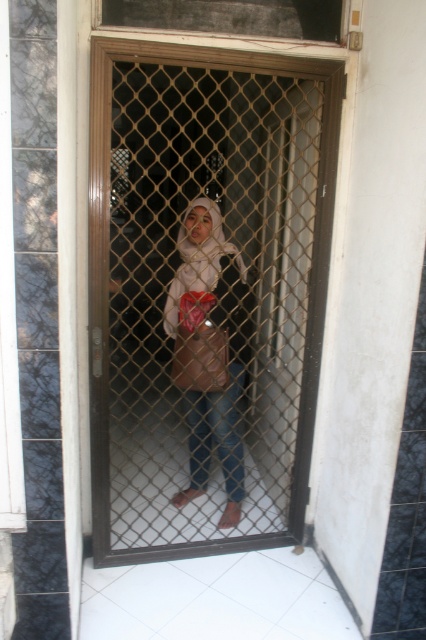
Based on the scene described, which object is positioned to the right when observing the metal mesh door at center and the matte beige hijab at center?

The matte beige hijab at center is to the right of the metal mesh door at center.

You are standing in front of a door with a metal security grill. The door has a dark brown wooden finish and a white door frame. There is a point marked at coordinates (206, 292). What is the significance of this point in relation to the metal mesh door at center?

The point (206, 292) represents the center of the metal mesh door at center.

You are a delivery person who needs to slide a package through the gap between the metal mesh door at center and the matte beige hijab at center. The package is 68 centimeters long. Can you fit the package through the gap?

The distance between the metal mesh door at center and the matte beige hijab at center is 68.22 centimeters. Since the package is 68 centimeters long, it can fit through the gap as the package is slightly shorter than the available space.